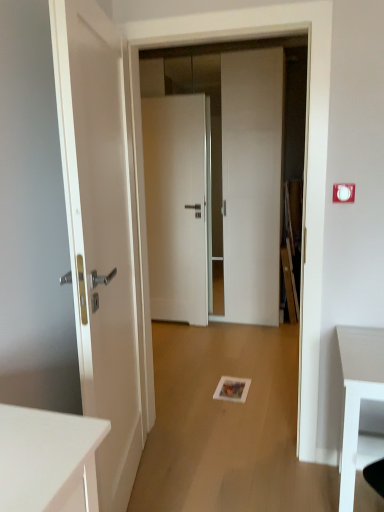
What is the approximate height of white plastic electric outlet at upper right?

white plastic electric outlet at upper right is 3.74 inches tall.

Where is `white plastic electric outlet at upper right`? white plastic electric outlet at upper right is located at coordinates (344, 193).

The height and width of the screenshot is (512, 384). What do you see at coordinates (102, 234) in the screenshot? I see `matte white door at left, which is counted as the 1th door, starting from the front` at bounding box center [102, 234].

The width and height of the screenshot is (384, 512). I want to click on white plastic electric outlet at upper right, so click(x=344, y=193).

Is white plastic electric outlet at upper right with white glossy door at center, which ranks as the second door in back-to-front order?

No, white plastic electric outlet at upper right is not making contact with white glossy door at center, which ranks as the second door in back-to-front order.

From a real-world perspective, who is located lower, white plastic electric outlet at upper right or white glossy door at center, the second door when ordered from front to back?

white glossy door at center, the second door when ordered from front to back, is physically lower.

Between point (333, 189) and point (237, 56), which one is positioned in front?

The point (333, 189) is more forward.

From the image's perspective, between white plastic electric outlet at upper right and white glossy door at center, which ranks as the second door in back-to-front order, who is located below?

white plastic electric outlet at upper right appears lower in the image.

Considering the sizes of white matte door at center, acting as the third door starting from the front, and matte white door at left, acting as the 3th door starting from the back, in the image, is white matte door at center, acting as the third door starting from the front, wider or thinner than matte white door at left, acting as the 3th door starting from the back,?

white matte door at center, acting as the third door starting from the front, is thinner than matte white door at left, acting as the 3th door starting from the back.

Does white matte door at center, acting as the third door starting from the front, have a larger size compared to matte white door at left, which is counted as the 1th door, starting from the front?

Actually, white matte door at center, acting as the third door starting from the front, might be smaller than matte white door at left, which is counted as the 1th door, starting from the front.

Which is correct: white matte door at center, which is counted as the first door, starting from the back, is inside matte white door at left, which is counted as the 1th door, starting from the front, or outside of it?

white matte door at center, which is counted as the first door, starting from the back, cannot be found inside matte white door at left, which is counted as the 1th door, starting from the front.

Can you confirm if white matte door at center, acting as the third door starting from the front, is shorter than matte white door at left, which is counted as the 1th door, starting from the front?

Yes, white matte door at center, acting as the third door starting from the front, is shorter than matte white door at left, which is counted as the 1th door, starting from the front.

Find the location of a particular element. the 1st door directly beneath the white glossy door at center, which ranks as the second door in back-to-front order (from a real-world perspective) is located at coordinates tap(177, 206).

Can you confirm if white matte door at center, which is counted as the first door, starting from the back, is smaller than white glossy door at center, which ranks as the second door in back-to-front order?

Indeed, white matte door at center, which is counted as the first door, starting from the back, has a smaller size compared to white glossy door at center, which ranks as the second door in back-to-front order.

Which is nearer, (189, 215) or (190, 126)?

Point (189, 215) appears to be farther away from the viewer than point (190, 126).

Considering the positions of points (100, 409) and (165, 170), is point (100, 409) farther from camera compared to point (165, 170)?

No, (100, 409) is closer to viewer.

Is matte white door at left, which is counted as the 1th door, starting from the front, bigger or smaller than white matte door at center, which is counted as the first door, starting from the back?

matte white door at left, which is counted as the 1th door, starting from the front, is bigger than white matte door at center, which is counted as the first door, starting from the back.

How much distance is there between matte white door at left, acting as the 3th door starting from the back, and white matte door at center, acting as the third door starting from the front?

They are 1.91 meters apart.

Based on the photo, from the image's perspective, which object appears higher, matte white door at left, acting as the 3th door starting from the back, or white matte door at center, acting as the third door starting from the front?

white matte door at center, acting as the third door starting from the front.

Choose the correct answer: Is white matte door at center, acting as the third door starting from the front, inside white plastic electric outlet at upper right or outside it?

white matte door at center, acting as the third door starting from the front, is outside white plastic electric outlet at upper right.

Between point (168, 293) and point (349, 185), which one is positioned behind?

Positioned behind is point (168, 293).

Is white matte door at center, acting as the third door starting from the front, at the right side of white plastic electric outlet at upper right?

No.

Can you tell me how much white matte door at center, acting as the third door starting from the front, and white plastic electric outlet at upper right differ in facing direction?

There is a 0.455-degree angle between the facing directions of white matte door at center, acting as the third door starting from the front, and white plastic electric outlet at upper right.

Is white glossy door at center, the second door when ordered from front to back, far away from white matte door at center, acting as the third door starting from the front?

white glossy door at center, the second door when ordered from front to back, is near white matte door at center, acting as the third door starting from the front, not far away.

Would you say white glossy door at center, which ranks as the second door in back-to-front order, contains white matte door at center, which is counted as the first door, starting from the back?

No, white matte door at center, which is counted as the first door, starting from the back, is located outside of white glossy door at center, which ranks as the second door in back-to-front order.

Is point (175, 98) farther from viewer compared to point (179, 105)?

Yes, it is behind point (179, 105).

From the image's perspective, is white glossy door at center, the second door when ordered from front to back, above or below white matte door at center, acting as the third door starting from the front?

Based on their image positions, white glossy door at center, the second door when ordered from front to back, is located above white matte door at center, acting as the third door starting from the front.

Is point (138, 412) closer to viewer compared to point (268, 167)?

Yes, point (138, 412) is in front of point (268, 167).

Looking at the image, does matte white door at left, which is counted as the 1th door, starting from the front, seem bigger or smaller compared to white glossy door at center, which ranks as the second door in back-to-front order?

Considering their sizes, matte white door at left, which is counted as the 1th door, starting from the front, takes up less space than white glossy door at center, which ranks as the second door in back-to-front order.

From the matte white door at left, which is counted as the 1th door, starting from the front, count 1st doors backward and point to it. Please provide its 2D coordinates.

[(215, 195)]

Starting from the white plastic electric outlet at upper right, which door is the 1st one behind? Please provide its 2D coordinates.

[(215, 195)]

Where is `door that is the 2nd one when counting forward from the white matte door at center, acting as the third door starting from the front`? door that is the 2nd one when counting forward from the white matte door at center, acting as the third door starting from the front is located at coordinates (102, 234).

Which object lies further to the anchor point white plastic electric outlet at upper right, white matte door at center, acting as the third door starting from the front, or white glossy door at center, which ranks as the second door in back-to-front order?

Based on the image, white matte door at center, acting as the third door starting from the front, appears to be further to white plastic electric outlet at upper right.

From the image, which object appears to be farther from white matte door at center, which is counted as the first door, starting from the back, white glossy door at center, the second door when ordered from front to back, or matte white door at left, which is counted as the 1th door, starting from the front?

matte white door at left, which is counted as the 1th door, starting from the front, lies further to white matte door at center, which is counted as the first door, starting from the back, than the other object.

Which object lies nearer to the anchor point white glossy door at center, the second door when ordered from front to back, white plastic electric outlet at upper right or white matte door at center, which is counted as the first door, starting from the back?

The object closer to white glossy door at center, the second door when ordered from front to back, is white matte door at center, which is counted as the first door, starting from the back.

Consider the image. Which object lies nearer to the anchor point matte white door at left, acting as the 3th door starting from the back, white plastic electric outlet at upper right or white matte door at center, which is counted as the first door, starting from the back?

white plastic electric outlet at upper right lies closer to matte white door at left, acting as the 3th door starting from the back, than the other object.

From the image, which object appears to be nearer to white matte door at center, acting as the third door starting from the front, white glossy door at center, the second door when ordered from front to back, or white plastic electric outlet at upper right?

white glossy door at center, the second door when ordered from front to back.

Estimate the real-world distances between objects in this image. Which object is closer to white plastic electric outlet at upper right, white glossy door at center, which ranks as the second door in back-to-front order, or matte white door at left, acting as the 3th door starting from the back?

matte white door at left, acting as the 3th door starting from the back, is closer to white plastic electric outlet at upper right.

From the image, which object appears to be nearer to white glossy door at center, which ranks as the second door in back-to-front order, matte white door at left, which is counted as the 1th door, starting from the front, or white matte door at center, acting as the third door starting from the front?

white matte door at center, acting as the third door starting from the front, is closer to white glossy door at center, which ranks as the second door in back-to-front order.

Which object lies further to the anchor point white plastic electric outlet at upper right, white matte door at center, which is counted as the first door, starting from the back, or matte white door at left, which is counted as the 1th door, starting from the front?

white matte door at center, which is counted as the first door, starting from the back.

The width and height of the screenshot is (384, 512). What are the coordinates of `door between matte white door at left, which is counted as the 1th door, starting from the front, and white matte door at center, acting as the third door starting from the front, along the z-axis` in the screenshot? It's located at (215, 195).

Image resolution: width=384 pixels, height=512 pixels. I want to click on door positioned between white plastic electric outlet at upper right and white matte door at center, acting as the third door starting from the front, from near to far, so click(x=215, y=195).

Locate an element on the screen. This screenshot has width=384, height=512. electric outlet between matte white door at left, acting as the 3th door starting from the back, and white matte door at center, acting as the third door starting from the front, from front to back is located at coordinates (344, 193).

Where is `electric outlet located between matte white door at left, which is counted as the 1th door, starting from the front, and white glossy door at center, the second door when ordered from front to back, in the depth direction`? Image resolution: width=384 pixels, height=512 pixels. electric outlet located between matte white door at left, which is counted as the 1th door, starting from the front, and white glossy door at center, the second door when ordered from front to back, in the depth direction is located at coordinates (344, 193).